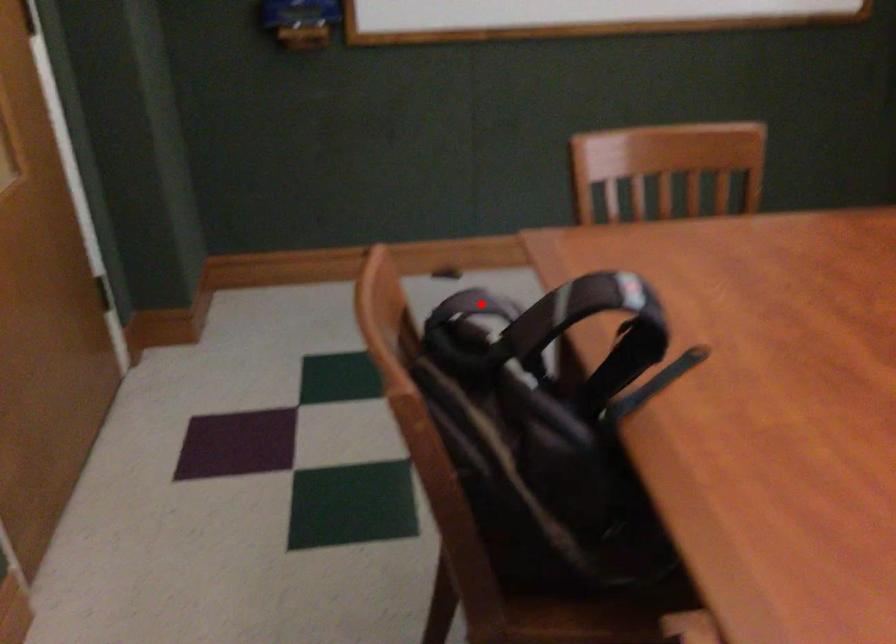
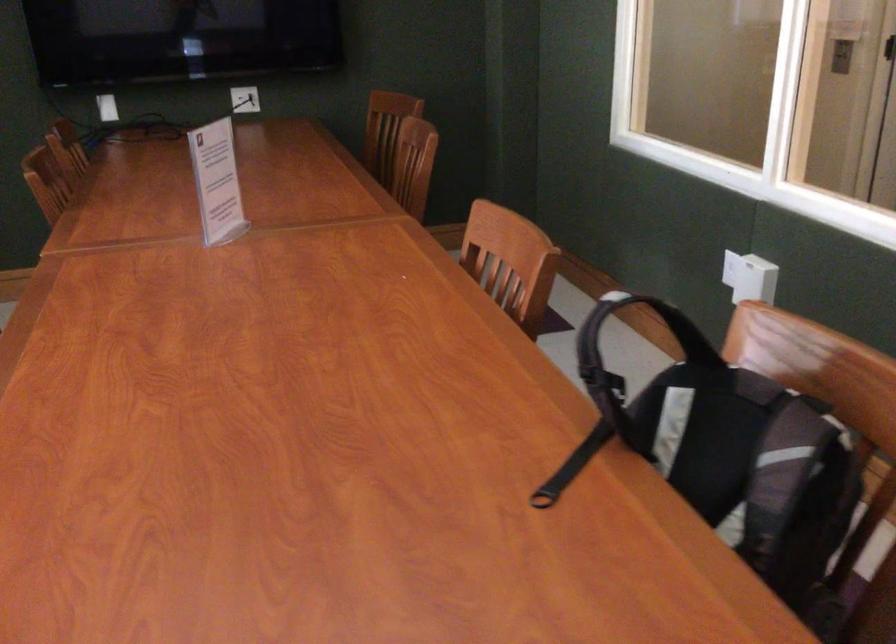
Question: I am providing you with two images of the same scene from different viewpoints. Image1 has a red point marked. In image2, the corresponding 3D location appears at what relative position? Reply with the corresponding letter.

Choices:
 (A) Closer
 (B) Farther

Answer: (A)